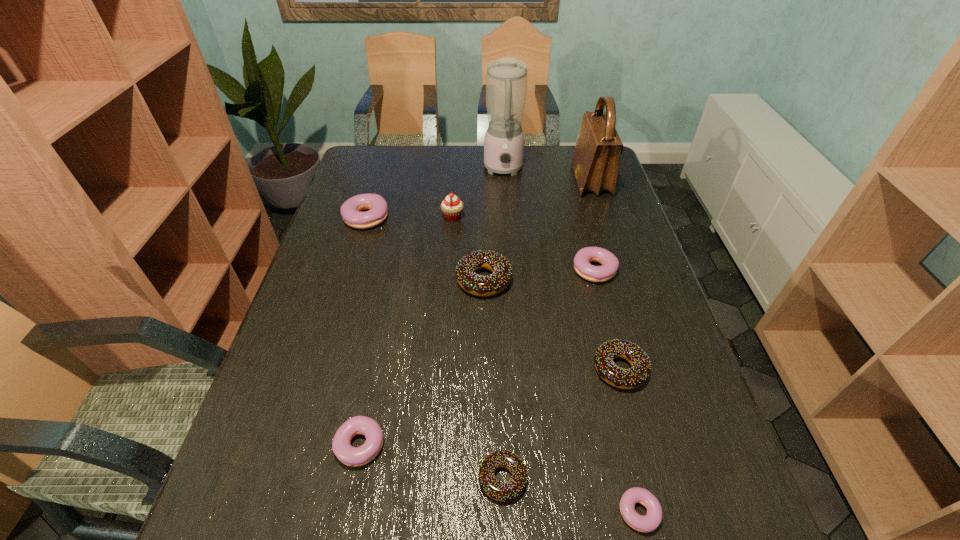
The width and height of the screenshot is (960, 540). What are the coordinates of `object at the left edge` in the screenshot? It's located at (351, 209).

Where is `shoulder bag that is at the right edge`? shoulder bag that is at the right edge is located at coordinates (595, 162).

Find the location of a particular element. object that is positioned at the far right corner is located at coordinates (595, 162).

The width and height of the screenshot is (960, 540). I want to click on object that is at the near right corner, so coord(649,522).

The image size is (960, 540). In the image, there is a desktop. In order to click on vacant space at the far edge in this screenshot , I will do `click(442, 178)`.

What are the coordinates of `free region at the left edge of the desktop` in the screenshot? It's located at (323, 273).

The height and width of the screenshot is (540, 960). In the image, there is a desktop. What are the coordinates of `vacant region at the right edge` in the screenshot? It's located at (715, 456).

Locate an element on the screen. Image resolution: width=960 pixels, height=540 pixels. free space at the far left corner is located at coordinates (390, 148).

You are a GUI agent. You are given a task and a screenshot of the screen. Output one action in this format:
    pyautogui.click(x=<x>, y=<y>)
    Task: Click on the empty location between the nearest chocolate doughnut and the shortest object
    
    Given the screenshot: What is the action you would take?
    pyautogui.click(x=570, y=492)

Where is `vacant area that lies between the biggest chocolate doughnut and the smallest chocolate doughnut`? This screenshot has width=960, height=540. vacant area that lies between the biggest chocolate doughnut and the smallest chocolate doughnut is located at coordinates (493, 379).